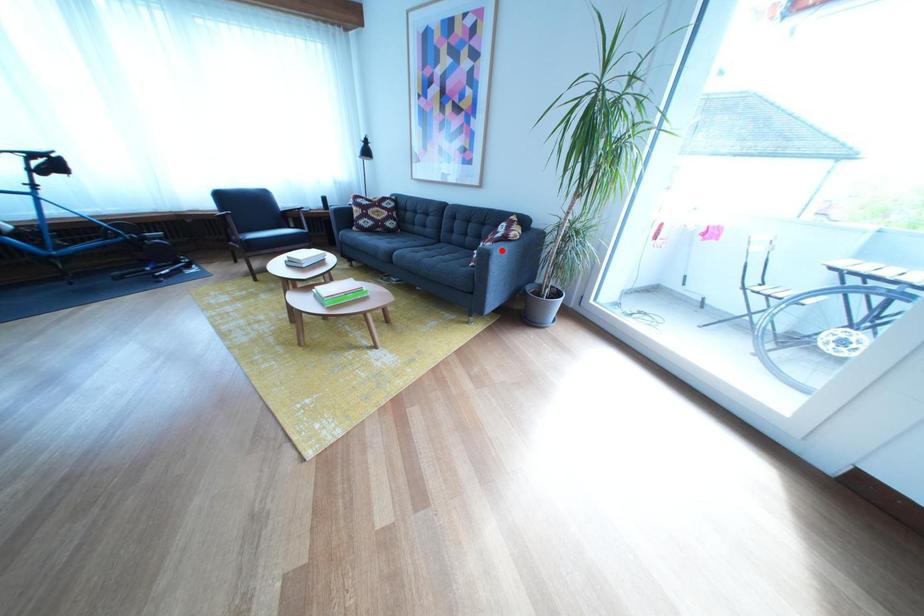
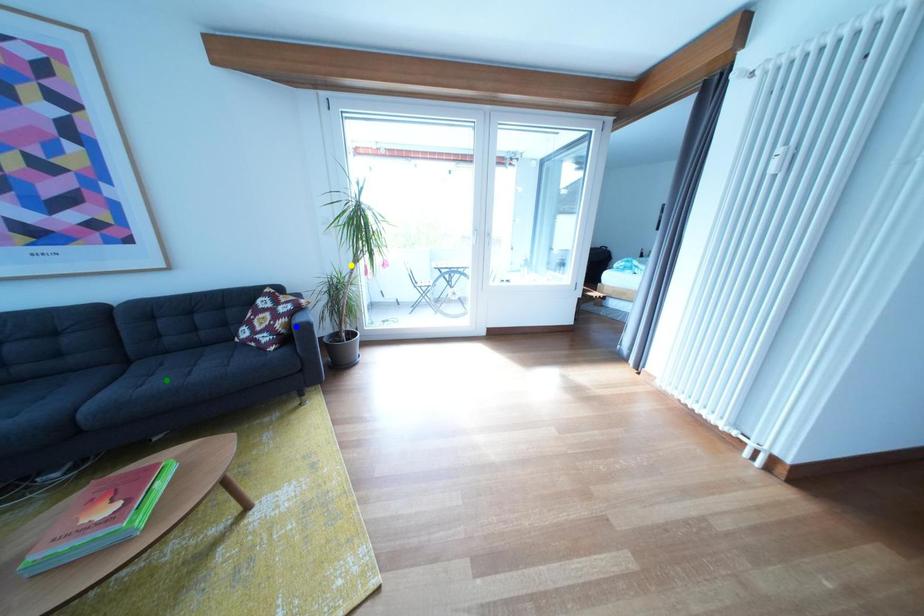
Question: I am providing you with two images of the same scene from different viewpoints. A red point is marked on the first image. You are given multiple points on the second image. Which point in image 2 is actually the same real-world point as the red point in image 1?

Choices:
 (A) green point
 (B) yellow point
 (C) blue point

Answer: (C)